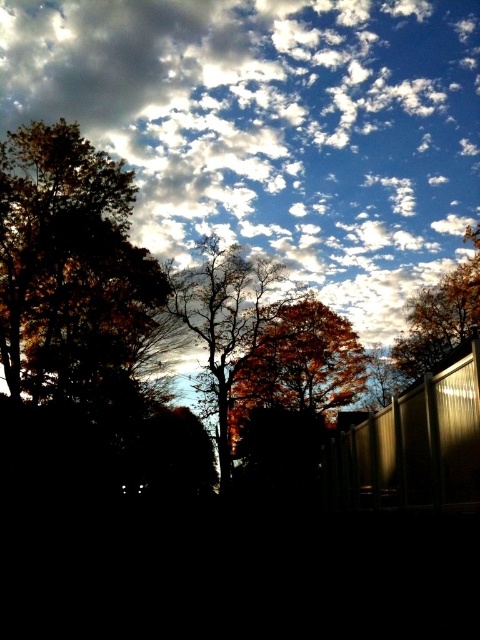
Question: Is white fluffy cloud at upper center further to the viewer compared to metallic corrugated fence at lower right?

Choices:
 (A) yes
 (B) no

Answer: (A)

Question: Which point is farther to the camera?

Choices:
 (A) (264, 364)
 (B) (372, 497)
 (C) (479, 330)

Answer: (C)

Question: Is bare branches at center wider than orange leafy tree at upper right?

Choices:
 (A) yes
 (B) no

Answer: (B)

Question: Which object appears closest to the camera in this image?

Choices:
 (A) orange leafy tree at center
 (B) metallic corrugated fence at lower right

Answer: (B)

Question: Can you confirm if golden-brown foliage at left is positioned above orange leafy tree at center?

Choices:
 (A) no
 (B) yes

Answer: (B)

Question: Among these objects, which one is farthest from the camera?

Choices:
 (A) orange leafy tree at center
 (B) metallic corrugated fence at lower right
 (C) white fluffy cloud at upper center

Answer: (C)